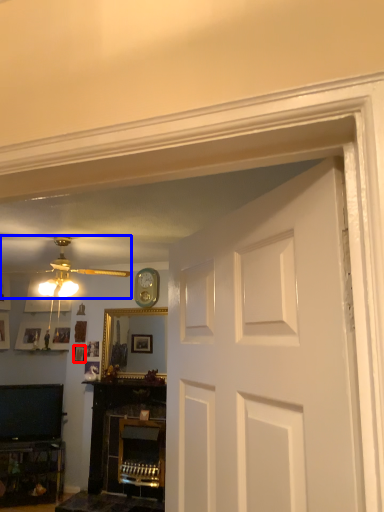
Question: Which object appears farthest to the camera in this image, picture frame (highlighted by a red box) or ceiling fan (highlighted by a blue box)?

Choices:
 (A) picture frame
 (B) ceiling fan

Answer: (A)